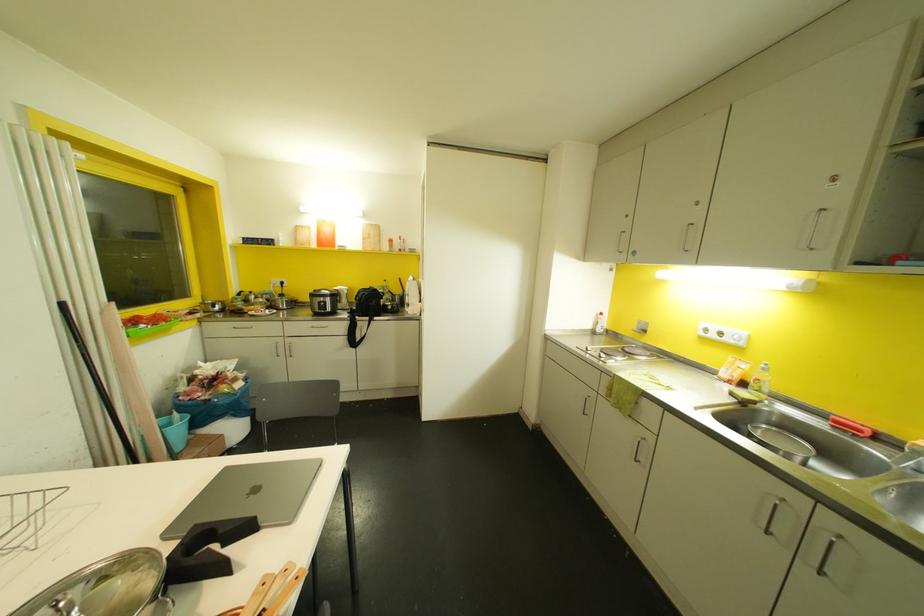
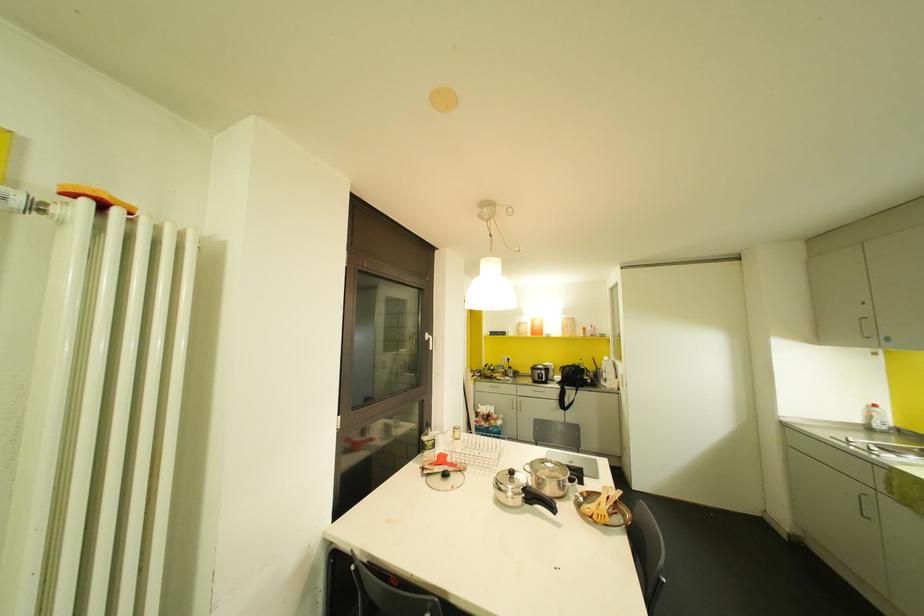
Where in the second image is the point corresponding to (324,241) from the first image?

(536, 331)